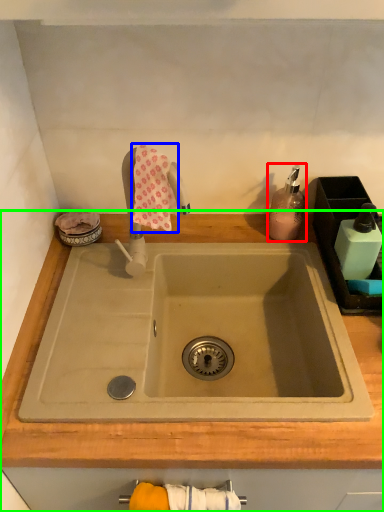
Question: Based on their relative distances, which object is farther from soap dispenser (highlighted by a red box)? Choose from bath towel (highlighted by a blue box) and countertop (highlighted by a green box).

Choices:
 (A) bath towel
 (B) countertop

Answer: (A)